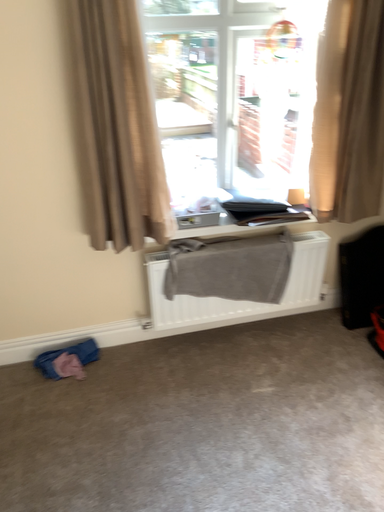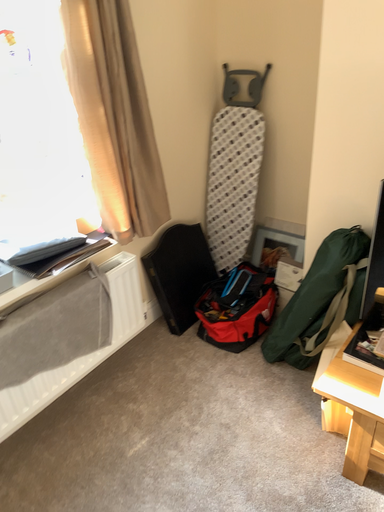
Question: Which way did the camera rotate in the video?

Choices:
 (A) rotated upward
 (B) rotated downward

Answer: (A)